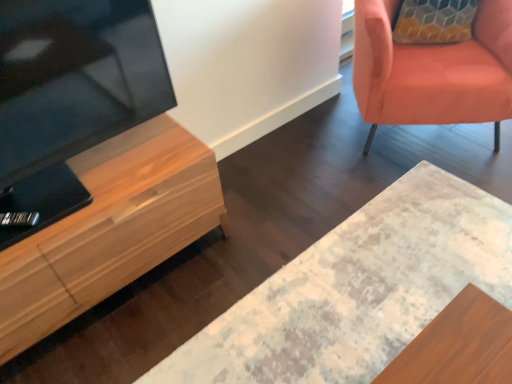
The height and width of the screenshot is (384, 512). What are the coordinates of `matte wood television at left` in the screenshot? It's located at (70, 95).

Which is more to the right, distressed wood desk at center or matte wood television at left?

distressed wood desk at center is more to the right.

Is distressed wood desk at center positioned beyond the bounds of matte wood television at left?

Yes.

Is there a large distance between distressed wood desk at center and matte wood television at left?

distressed wood desk at center is actually quite close to matte wood television at left.

From a real-world perspective, between distressed wood desk at center and light wood cabinet at left, who is vertically lower?

distressed wood desk at center, from a real-world perspective.

Which is more to the left, distressed wood desk at center or light wood cabinet at left?

light wood cabinet at left.

In the scene shown: Is distressed wood desk at center completely or partially outside of light wood cabinet at left?

Yes, distressed wood desk at center is outside of light wood cabinet at left.

This screenshot has height=384, width=512. Identify the location of cabinetry that appears on the left of distressed wood desk at center. (111, 229).

Measure the distance between matte wood television at left and distressed wood desk at center.

A distance of 35.21 inches exists between matte wood television at left and distressed wood desk at center.

Looking at this image, is matte wood television at left positioned with its back to distressed wood desk at center?

No, matte wood television at left's orientation is not away from distressed wood desk at center.

Is matte wood television at left far from distressed wood desk at center?

Actually, matte wood television at left and distressed wood desk at center are a little close together.

Which point is more forward, [5,74] or [203,335]?

The point [5,74] is in front.

Locate an element on the screen. television that is above the light wood cabinet at left (from the image's perspective) is located at coordinates (70, 95).

In the scene shown: Who is shorter, matte wood television at left or light wood cabinet at left?

light wood cabinet at left.

From a real-world perspective, is matte wood television at left physically below light wood cabinet at left?

A: No, from a real-world perspective, matte wood television at left is not beneath light wood cabinet at left.

Does matte wood television at left have a lesser width compared to light wood cabinet at left?

Yes.

Between light wood cabinet at left and matte orange chair at upper right, which one has less height?

Standing shorter between the two is light wood cabinet at left.

Where is `chair behind the light wood cabinet at left`? The width and height of the screenshot is (512, 384). chair behind the light wood cabinet at left is located at coordinates (433, 71).

Is light wood cabinet at left thinner than matte orange chair at upper right?

Correct, the width of light wood cabinet at left is less than that of matte orange chair at upper right.

Consider the image. Which of these two, light wood cabinet at left or matte orange chair at upper right, is bigger?

matte orange chair at upper right.

From a real-world perspective, who is located lower, distressed wood desk at center or matte orange chair at upper right?

distressed wood desk at center.

Where is `desk below the matte orange chair at upper right (from a real-world perspective)`? The image size is (512, 384). desk below the matte orange chair at upper right (from a real-world perspective) is located at coordinates (358, 289).

Do you think distressed wood desk at center is within matte orange chair at upper right, or outside of it?

distressed wood desk at center is located beyond the bounds of matte orange chair at upper right.

Does distressed wood desk at center have a smaller size compared to matte orange chair at upper right?

Indeed, distressed wood desk at center has a smaller size compared to matte orange chair at upper right.

Does matte wood television at left have a larger size compared to matte orange chair at upper right?

No, matte wood television at left is not bigger than matte orange chair at upper right.

From a real-world perspective, is matte wood television at left located higher than matte orange chair at upper right?

Yes, from a real-world perspective, matte wood television at left is above matte orange chair at upper right.

Where is `television on the left of matte orange chair at upper right`? television on the left of matte orange chair at upper right is located at coordinates (70, 95).

This screenshot has width=512, height=384. In order to click on desk behind the matte wood television at left in this screenshot , I will do `click(358, 289)`.

Image resolution: width=512 pixels, height=384 pixels. Find the location of `desk below the light wood cabinet at left (from a real-world perspective)`. desk below the light wood cabinet at left (from a real-world perspective) is located at coordinates (358, 289).

Considering their positions, is light wood cabinet at left positioned further to matte wood television at left than matte orange chair at upper right?

matte orange chair at upper right is positioned further to the anchor matte wood television at left.

Looking at the image, which one is located closer to light wood cabinet at left, distressed wood desk at center or matte orange chair at upper right?

distressed wood desk at center.

From the picture: Estimate the real-world distances between objects in this image. Which object is closer to distressed wood desk at center, matte orange chair at upper right or light wood cabinet at left?

Among the two, light wood cabinet at left is located nearer to distressed wood desk at center.

Looking at the image, which one is located closer to distressed wood desk at center, light wood cabinet at left or matte orange chair at upper right?

Based on the image, light wood cabinet at left appears to be nearer to distressed wood desk at center.

Looking at the image, which one is located further to matte orange chair at upper right, light wood cabinet at left or matte wood television at left?

matte wood television at left is positioned further to the anchor matte orange chair at upper right.

From the image, which object appears to be nearer to light wood cabinet at left, matte orange chair at upper right or distressed wood desk at center?

distressed wood desk at center.

Looking at the image, which one is located further to matte orange chair at upper right, distressed wood desk at center or matte wood television at left?

matte wood television at left lies further to matte orange chair at upper right than the other object.

From the image, which object appears to be nearer to light wood cabinet at left, distressed wood desk at center or matte wood television at left?

The object closer to light wood cabinet at left is matte wood television at left.

Locate an element on the screen. desk between matte wood television at left and matte orange chair at upper right in the horizontal direction is located at coordinates (358, 289).

Locate an element on the screen. The width and height of the screenshot is (512, 384). television between light wood cabinet at left and distressed wood desk at center from left to right is located at coordinates (70, 95).

The width and height of the screenshot is (512, 384). I want to click on television between light wood cabinet at left and matte orange chair at upper right, so click(x=70, y=95).

You are a GUI agent. You are given a task and a screenshot of the screen. Output one action in this format:
    pyautogui.click(x=<x>, y=<y>)
    Task: Click on the desk between light wood cabinet at left and matte orange chair at upper right from left to right
    This screenshot has width=512, height=384.
    Given the screenshot: What is the action you would take?
    pyautogui.click(x=358, y=289)